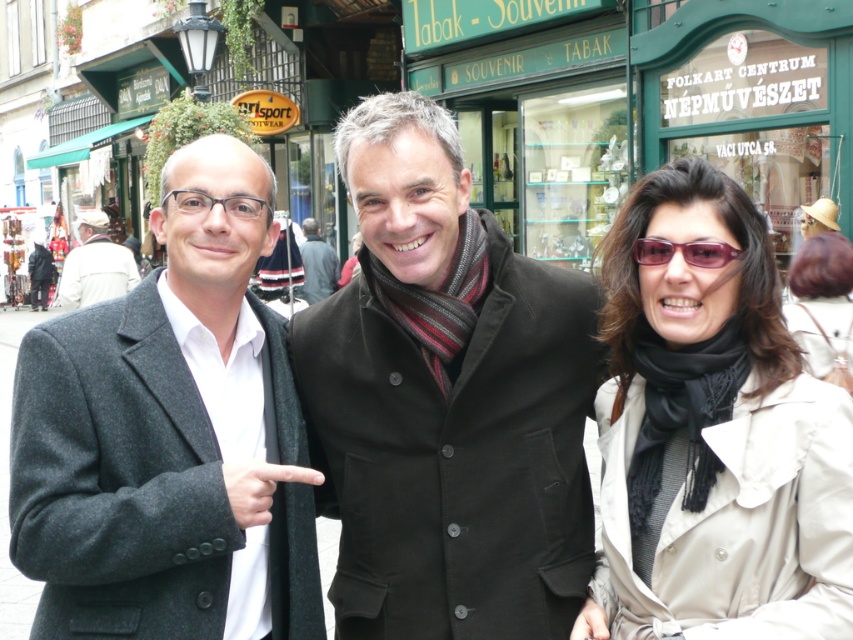
Question: Can you confirm if matte gray blazer at center is thinner than fuzzy gray hand at lower right?

Choices:
 (A) yes
 (B) no

Answer: (B)

Question: Is dark brown wool coat at center to the left of white cotton shirt at left from the viewer's perspective?

Choices:
 (A) yes
 (B) no

Answer: (B)

Question: Where is matte beige coat at right located in relation to white cotton shirt at left in the image?

Choices:
 (A) above
 (B) below

Answer: (B)

Question: Which point appears farthest from the camera in this image?

Choices:
 (A) (651, 426)
 (B) (699, 252)
 (C) (589, 604)
 (D) (801, 339)

Answer: (D)

Question: Which of the following is the farthest from the observer?

Choices:
 (A) (207, 196)
 (B) (517, 550)
 (C) (311, 268)

Answer: (C)

Question: Among these objects, which one is farthest from the camera?

Choices:
 (A) purple acetate sunglasses at center
 (B) matte gray blazer at center
 (C) fuzzy gray hand at lower right
 (D) matte beige coat at right

Answer: (D)